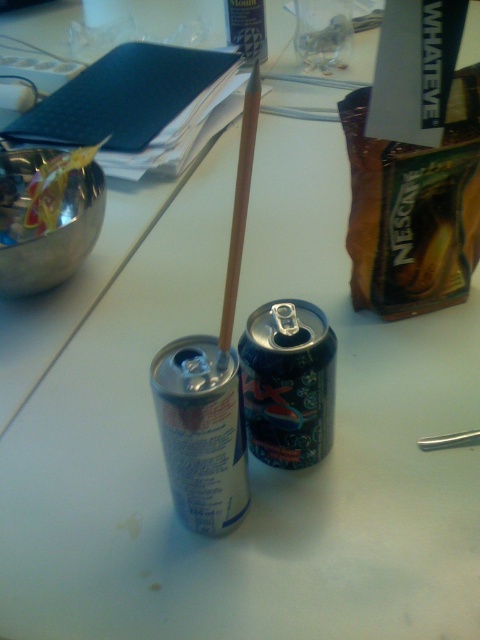
Question: Is silver metallic red bull can at center smaller than wooden straw at center?

Choices:
 (A) yes
 (B) no

Answer: (A)

Question: Among these objects, which one is farthest from the camera?

Choices:
 (A) wooden straw at center
 (B) silver metallic red bull can at center
 (C) shiny metallic can at center

Answer: (C)

Question: Considering the relative positions of silver metallic red bull can at center and shiny metallic can at center in the image provided, where is silver metallic red bull can at center located with respect to shiny metallic can at center?

Choices:
 (A) above
 (B) below

Answer: (B)

Question: Estimate the real-world distances between objects in this image. Which object is farther from the wooden straw at center?

Choices:
 (A) shiny metallic can at center
 (B) silver metallic red bull can at center

Answer: (A)

Question: Where is silver metallic red bull can at center located in relation to shiny metallic can at center in the image?

Choices:
 (A) below
 (B) above

Answer: (A)

Question: Which of these objects is positioned closest to the wooden straw at center?

Choices:
 (A) silver metallic red bull can at center
 (B) shiny metallic can at center

Answer: (A)